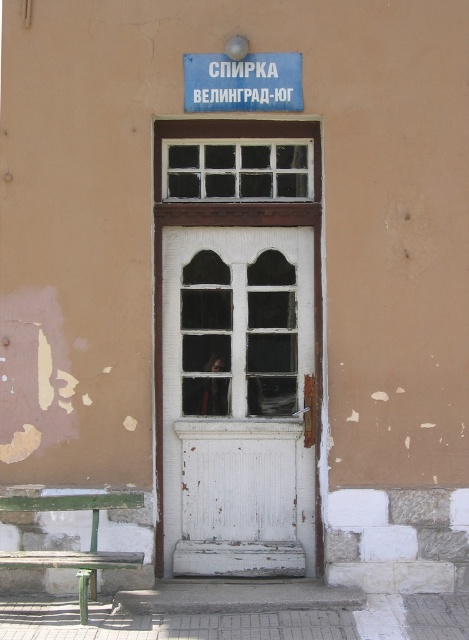
Which is more to the left, white wooden window at center or blue painted metal sign at upper center?

Positioned to the left is white wooden window at center.

Is the position of white wooden window at center less distant than that of blue painted metal sign at upper center?

No.

Does point (190, 150) come farther from viewer compared to point (219, 67)?

Yes, it is behind point (219, 67).

Where is `white wooden window at center`? The height and width of the screenshot is (640, 469). white wooden window at center is located at coordinates (236, 170).

Is point (295, 412) more distant than point (250, 109)?

Yes, point (295, 412) is farther from viewer.

Can you confirm if white wooden door at center is shorter than blue painted metal sign at upper center?

No.

In order to click on white wooden door at center in this screenshot , I will do `click(236, 397)`.

Is white wooden door at center below white wooden window at center?

Indeed, white wooden door at center is positioned under white wooden window at center.

Is point (234, 477) positioned before point (282, 188)?

Yes, it is.

Find the location of a particular element. Image resolution: width=469 pixels, height=640 pixels. white wooden door at center is located at coordinates (236, 397).